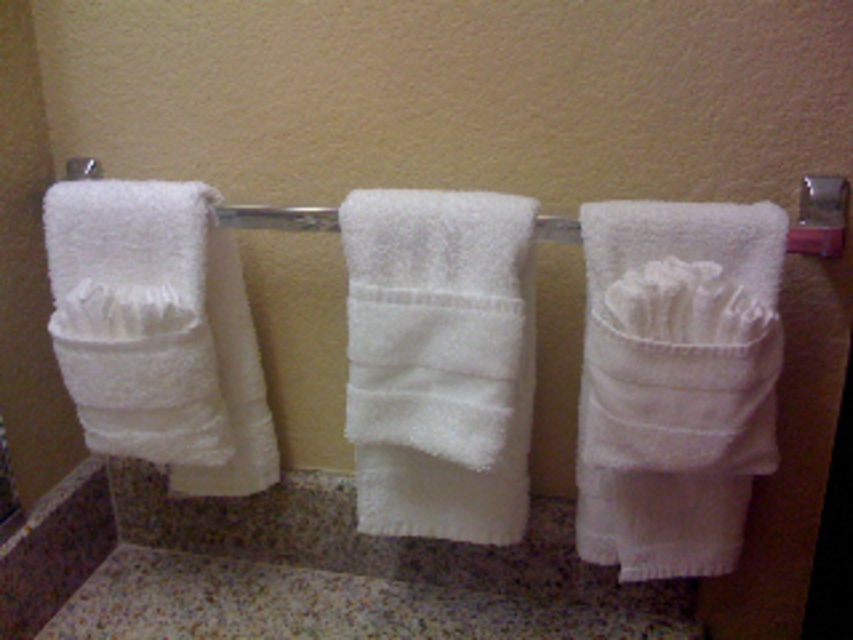
You are organizing towels in a bathroom and need to place a new towel between the white soft towel at right and the white fluffy towel at center. Based on their current positions, where should the new towel be placed?

The white soft towel at right is below the white fluffy towel at center. Therefore, the new towel should be placed above the white soft towel at right or below the white fluffy towel at center to maintain the existing arrangement.

You are a person with a 5 inch wide object that you want to place between the white soft towel at right and the white fluffy towel at center. Based on the scene description, will the object fit between them?

The white soft towel at right and white fluffy towel at center are 4.78 inches apart. Since the object is 5 inches wide, it will not fit between them as the space is slightly narrower than the object.

You are standing in the bathroom and see the white soft towel at right. If you want to reach the point at coordinates (675, 381), which object should you interact with?

The point at coordinates (675, 381) corresponds to the white soft towel at right, so you should interact with the white soft towel at right.